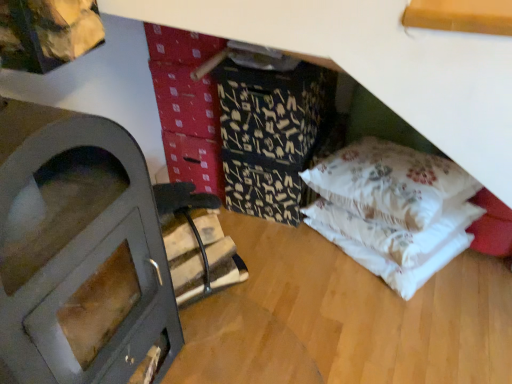
What do you see at coordinates (391, 183) in the screenshot? I see `fluffy white pillow at lower right` at bounding box center [391, 183].

In order to face fluffy white pillow at lower right, should I rotate leftwards or rightwards?

Rotate right and turn 17.060 degrees.

Locate an element on the screen. fluffy white pillow at lower right is located at coordinates (391, 183).

This screenshot has height=384, width=512. Find the location of `fluffy white pillow at lower right`. fluffy white pillow at lower right is located at coordinates click(x=391, y=183).